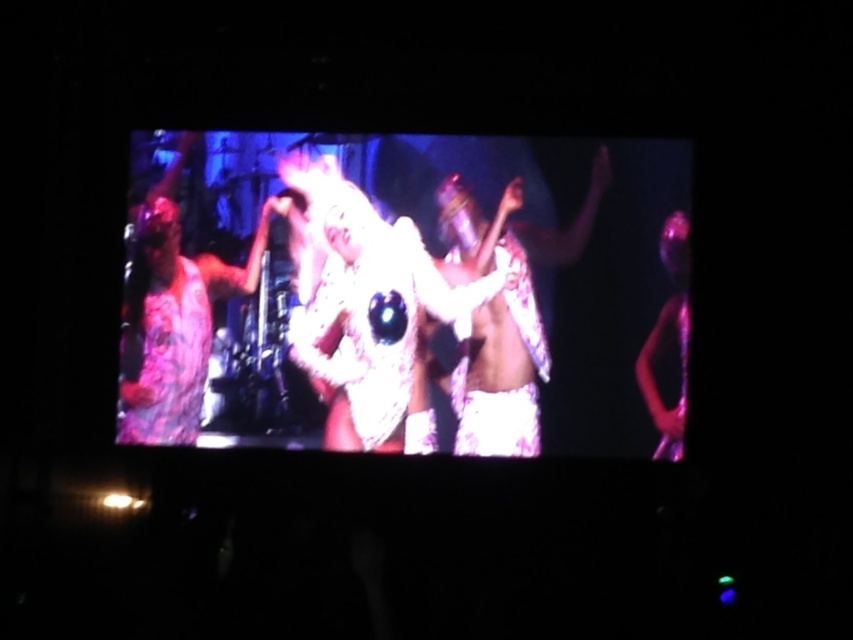
You are a photographer trying to capture the central figure on stage. You notice two points marked in the image. One is at point (387,406) and the other at point (688,353). Which point is closer to your camera lens?

Point (387,406) is closer to the camera than point (688,353).

You are a stagehand who needs to adjust the height of the lighting rig above the performers. The white fluffy costume at center and the purple iridescent figure at right are both under the rig. Which performer requires the lighting rig to be raised higher to avoid shining directly on their head?

The purple iridescent figure at right requires the lighting rig to be raised higher because it is taller than the white fluffy costume at center.

You are a stagehand preparing to move a large prop from the left side of the stage to the right side. You need to pass between the white fluffy costume at center and the purple iridescent figure at right. Based on their positions, which side of the path between them should you approach from to avoid blocking the performers?

You should approach from the right side of the path between the white fluffy costume at center and the purple iridescent figure at right since the white fluffy costume at center is to the left of the purple iridescent figure at right, meaning the path is to the right of the white fluffy costume at center and left of the purple iridescent figure at right.